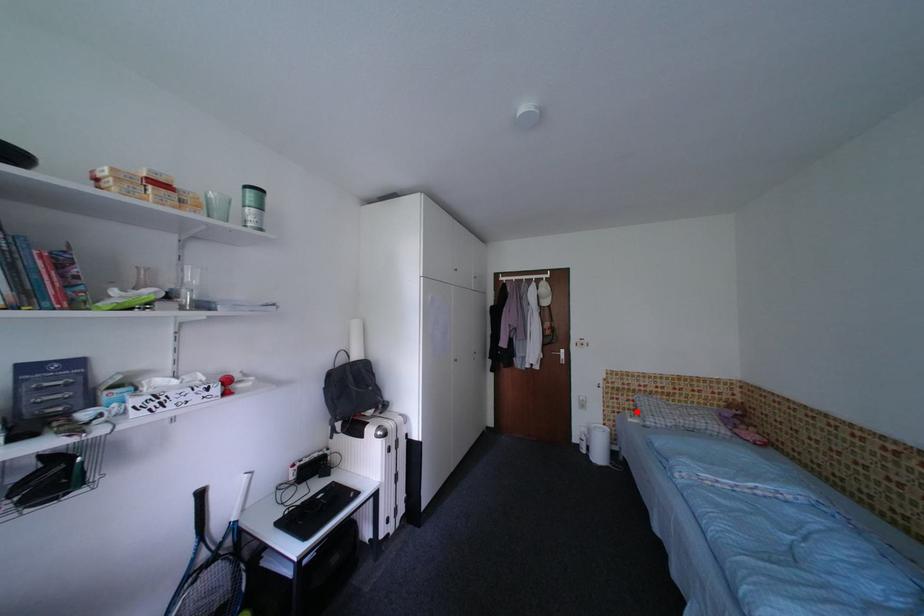
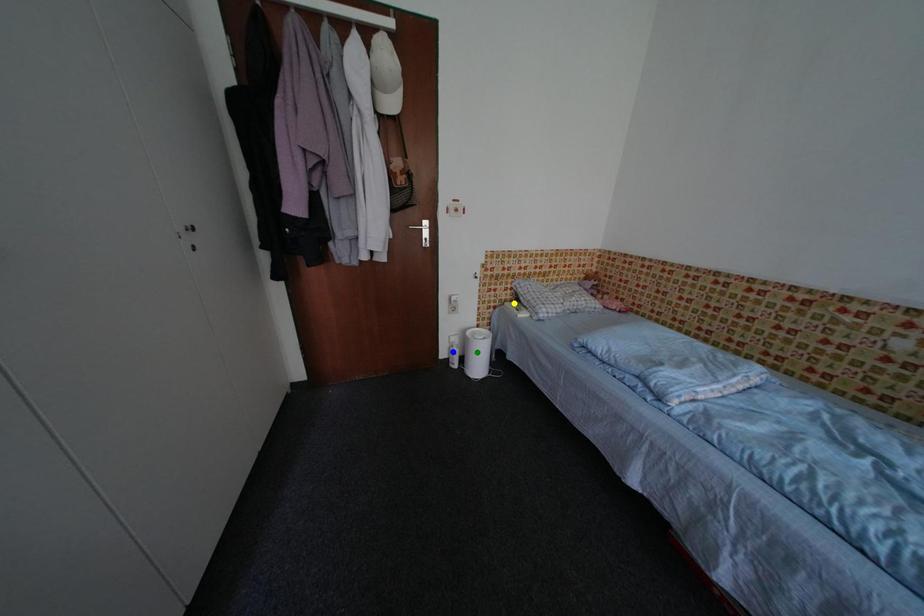
Question: I am providing you with two images of the same scene from different viewpoints. A red point is marked on the first image. You are given multiple points on the second image. Which point in image 2 represents the same 3d spot as the red point in image 1?

Choices:
 (A) green point
 (B) yellow point
 (C) blue point

Answer: (B)